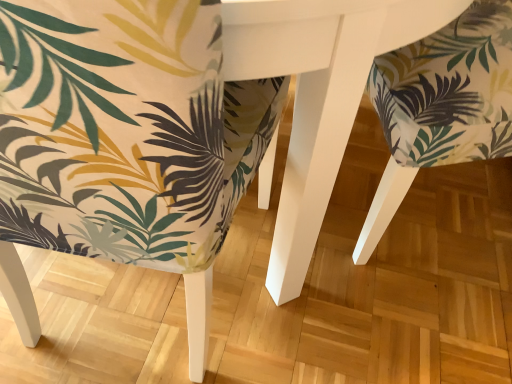
What do you see at coordinates (441, 105) in the screenshot? The height and width of the screenshot is (384, 512). I see `matte fabric chair at right, which is counted as the 1th chair, starting from the right` at bounding box center [441, 105].

Locate an element on the screen. The width and height of the screenshot is (512, 384). matte fabric chair at right, which is counted as the 1th chair, starting from the right is located at coordinates (441, 105).

Measure the distance between printed fabric chair at center, arranged as the 2th chair when viewed from the right, and camera.

printed fabric chair at center, arranged as the 2th chair when viewed from the right, and camera are 11.50 inches apart.

Image resolution: width=512 pixels, height=384 pixels. What do you see at coordinates (125, 130) in the screenshot? I see `printed fabric chair at center, arranged as the 2th chair when viewed from the right` at bounding box center [125, 130].

Measure the distance between point (116, 132) and camera.

Point (116, 132) is 40.50 centimeters from camera.

At what (x,y) coordinates should I click in order to perform the action: click on printed fabric chair at center, arranged as the 2th chair when viewed from the right. Please return your answer as a coordinate pair (x, y). Looking at the image, I should click on (125, 130).

This screenshot has height=384, width=512. Find the location of `matte fabric chair at right, the second chair from the left`. matte fabric chair at right, the second chair from the left is located at coordinates (441, 105).

Can you confirm if printed fabric chair at center, acting as the first chair starting from the left, is positioned to the left of matte fabric chair at right, which is counted as the 1th chair, starting from the right?

Yes.

Who is more distant, printed fabric chair at center, arranged as the 2th chair when viewed from the right, or matte fabric chair at right, the second chair from the left?

matte fabric chair at right, the second chair from the left, is further from the camera.

Which is in front, point (132, 121) or point (478, 119)?

Point (132, 121)

From the image's perspective, is printed fabric chair at center, arranged as the 2th chair when viewed from the right, on matte fabric chair at right, the second chair from the left?

Actually, printed fabric chair at center, arranged as the 2th chair when viewed from the right, appears below matte fabric chair at right, the second chair from the left, in the image.

From a real-world perspective, which is physically below, printed fabric chair at center, arranged as the 2th chair when viewed from the right, or matte fabric chair at right, the second chair from the left?

matte fabric chair at right, the second chair from the left.

Based on the photo, is printed fabric chair at center, acting as the first chair starting from the left, wider than matte fabric chair at right, which is counted as the 1th chair, starting from the right?

In fact, printed fabric chair at center, acting as the first chair starting from the left, might be narrower than matte fabric chair at right, which is counted as the 1th chair, starting from the right.

Considering the sizes of objects printed fabric chair at center, arranged as the 2th chair when viewed from the right, and matte fabric chair at right, the second chair from the left, in the image provided, who is taller, printed fabric chair at center, arranged as the 2th chair when viewed from the right, or matte fabric chair at right, the second chair from the left,?

printed fabric chair at center, arranged as the 2th chair when viewed from the right.

Based on their sizes in the image, would you say printed fabric chair at center, acting as the first chair starting from the left, is bigger or smaller than matte fabric chair at right, the second chair from the left?

printed fabric chair at center, acting as the first chair starting from the left, is bigger than matte fabric chair at right, the second chair from the left.

Consider the image. Is printed fabric chair at center, acting as the first chair starting from the left, spatially inside matte fabric chair at right, which is counted as the 1th chair, starting from the right, or outside of it?

printed fabric chair at center, acting as the first chair starting from the left, is located beyond the bounds of matte fabric chair at right, which is counted as the 1th chair, starting from the right.

Is printed fabric chair at center, arranged as the 2th chair when viewed from the right, placed right next to matte fabric chair at right, the second chair from the left?

printed fabric chair at center, arranged as the 2th chair when viewed from the right, and matte fabric chair at right, the second chair from the left, are clearly separated.

Is printed fabric chair at center, acting as the first chair starting from the left, oriented away from matte fabric chair at right, which is counted as the 1th chair, starting from the right?

That's not correct — printed fabric chair at center, acting as the first chair starting from the left, is not looking away from matte fabric chair at right, which is counted as the 1th chair, starting from the right.

How many degrees apart are the facing directions of printed fabric chair at center, acting as the first chair starting from the left, and matte fabric chair at right, which is counted as the 1th chair, starting from the right?

The angle between the facing direction of printed fabric chair at center, acting as the first chair starting from the left, and the facing direction of matte fabric chair at right, which is counted as the 1th chair, starting from the right, is 107 degrees.

Measure the distance between printed fabric chair at center, arranged as the 2th chair when viewed from the right, and matte fabric chair at right, the second chair from the left.

printed fabric chair at center, arranged as the 2th chair when viewed from the right, is 16.26 inches away from matte fabric chair at right, the second chair from the left.

The width and height of the screenshot is (512, 384). Find the location of `chair located above the printed fabric chair at center, arranged as the 2th chair when viewed from the right (from the image's perspective)`. chair located above the printed fabric chair at center, arranged as the 2th chair when viewed from the right (from the image's perspective) is located at coordinates coord(441,105).

From the picture: Is matte fabric chair at right, the second chair from the left, to the left or to the right of printed fabric chair at center, arranged as the 2th chair when viewed from the right, in the image?

matte fabric chair at right, the second chair from the left, is to the right of printed fabric chair at center, arranged as the 2th chair when viewed from the right.

Does matte fabric chair at right, which is counted as the 1th chair, starting from the right, come behind printed fabric chair at center, arranged as the 2th chair when viewed from the right?

Yes, matte fabric chair at right, which is counted as the 1th chair, starting from the right, is further from the camera.

Considering the positions of point (494, 26) and point (126, 118), is point (494, 26) closer or farther from the camera than point (126, 118)?

Point (494, 26) is farther from the camera than point (126, 118).

From the image's perspective, which one is positioned lower, matte fabric chair at right, which is counted as the 1th chair, starting from the right, or printed fabric chair at center, acting as the first chair starting from the left?

From the image's view, printed fabric chair at center, acting as the first chair starting from the left, is below.

From the picture: From a real-world perspective, is matte fabric chair at right, which is counted as the 1th chair, starting from the right, positioned under printed fabric chair at center, arranged as the 2th chair when viewed from the right, based on gravity?

Yes, from a real-world perspective, matte fabric chair at right, which is counted as the 1th chair, starting from the right, is under printed fabric chair at center, arranged as the 2th chair when viewed from the right.

Which object is wider, matte fabric chair at right, the second chair from the left, or printed fabric chair at center, arranged as the 2th chair when viewed from the right?

matte fabric chair at right, the second chair from the left, is wider.

Considering the relative sizes of matte fabric chair at right, the second chair from the left, and printed fabric chair at center, acting as the first chair starting from the left, in the image provided, is matte fabric chair at right, the second chair from the left, shorter than printed fabric chair at center, acting as the first chair starting from the left,?

Yes.

Who is smaller, matte fabric chair at right, the second chair from the left, or printed fabric chair at center, acting as the first chair starting from the left?

Smaller between the two is matte fabric chair at right, the second chair from the left.

Is printed fabric chair at center, arranged as the 2th chair when viewed from the right, surrounded by matte fabric chair at right, the second chair from the left?

Definitely not — printed fabric chair at center, arranged as the 2th chair when viewed from the right, is not inside matte fabric chair at right, the second chair from the left.

Is matte fabric chair at right, which is counted as the 1th chair, starting from the right, far from printed fabric chair at center, acting as the first chair starting from the left?

That's not correct — matte fabric chair at right, which is counted as the 1th chair, starting from the right, is a little close to printed fabric chair at center, acting as the first chair starting from the left.

Is matte fabric chair at right, the second chair from the left, positioned with its back to printed fabric chair at center, arranged as the 2th chair when viewed from the right?

No, matte fabric chair at right, the second chair from the left, is not facing away from printed fabric chair at center, arranged as the 2th chair when viewed from the right.

This screenshot has width=512, height=384. What are the coordinates of `chair in front of the matte fabric chair at right, which is counted as the 1th chair, starting from the right` in the screenshot? It's located at (125, 130).

Find the location of `chair above the matte fabric chair at right, which is counted as the 1th chair, starting from the right (from a real-world perspective)`. chair above the matte fabric chair at right, which is counted as the 1th chair, starting from the right (from a real-world perspective) is located at coordinates (125, 130).

This screenshot has height=384, width=512. I want to click on chair below the matte fabric chair at right, which is counted as the 1th chair, starting from the right (from the image's perspective), so click(x=125, y=130).